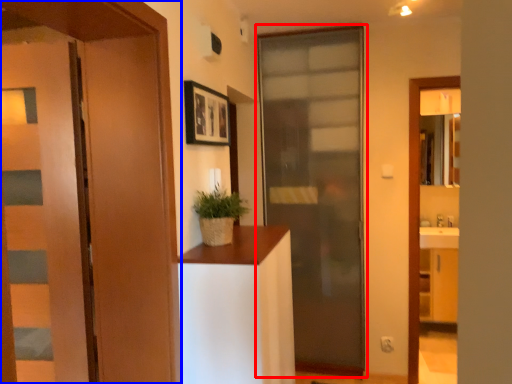
Question: Which object appears farthest to the camera in this image, door (highlighted by a red box) or door (highlighted by a blue box)?

Choices:
 (A) door
 (B) door

Answer: (A)